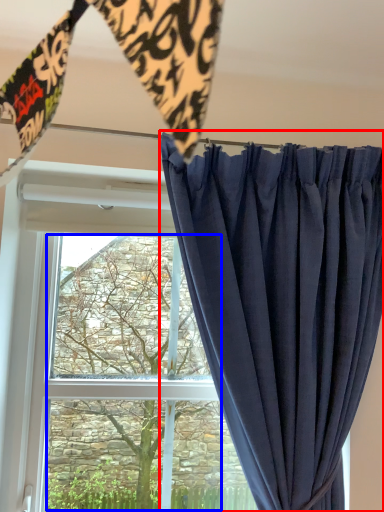
Question: Which of the following is the farthest to the observer, curtain (highlighted by a red box) or tree (highlighted by a blue box)?

Choices:
 (A) curtain
 (B) tree

Answer: (B)